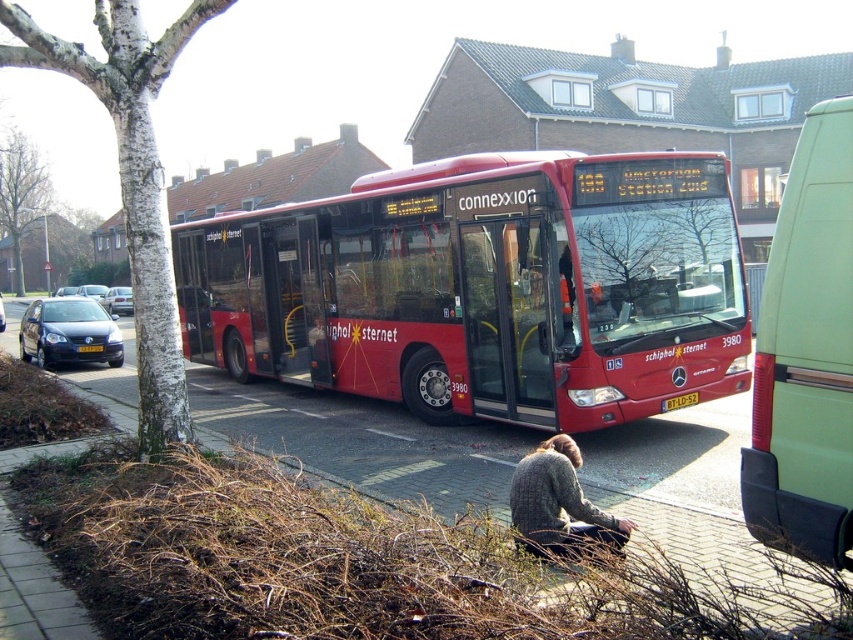
You are a delivery person who needs to park your van at the bus stop where the red matte bus at center is currently parked. What are the coordinates of the bus stop where you should park?

The coordinates of the bus stop where the red matte bus at center is parked are at point (485, 289).

You are standing at the bus stop and want to walk from point A to point B. Point A is at coordinate point [410,180] and point B is at coordinate point [561,435]. Which point is closer to you?

Point A at coordinate point [410,180] is closer to you because it is further to the viewer than point B at coordinate point [561,435].

You are a pedestrian standing on the brick pavement at lower center. You want to cross the road to reach a bench on the other side. Is the shiny black car at left blocking your path?

The brick pavement at lower center is to the right of the shiny black car at left, so the car is not blocking your path to the bench on the other side.